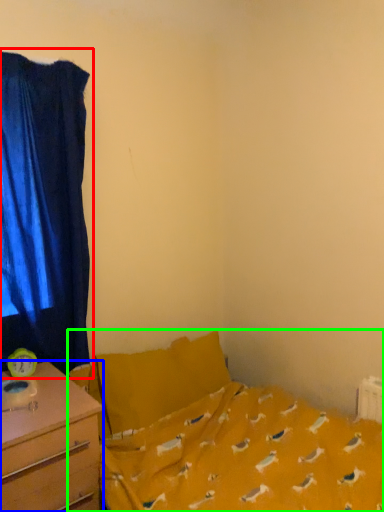
Question: Considering the real-world distances, which object is closest to curtain (highlighted by a red box)? desk (highlighted by a blue box) or bed (highlighted by a green box).

Choices:
 (A) desk
 (B) bed

Answer: (A)